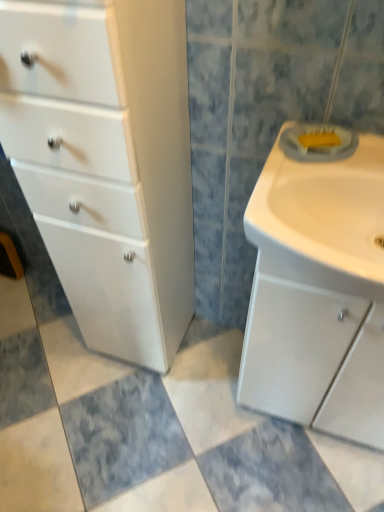
This screenshot has height=512, width=384. I want to click on spots to the right of white glossy cabinet at left, so click(208, 356).